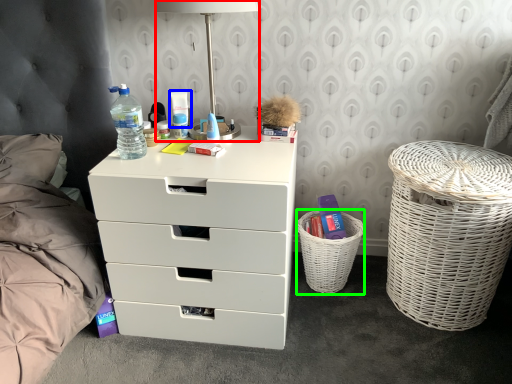
Question: Which object is the closest to the table lamp (highlighted by a red box)? Choose among these: toiletry (highlighted by a blue box) or basket (highlighted by a green box).

Choices:
 (A) toiletry
 (B) basket

Answer: (A)